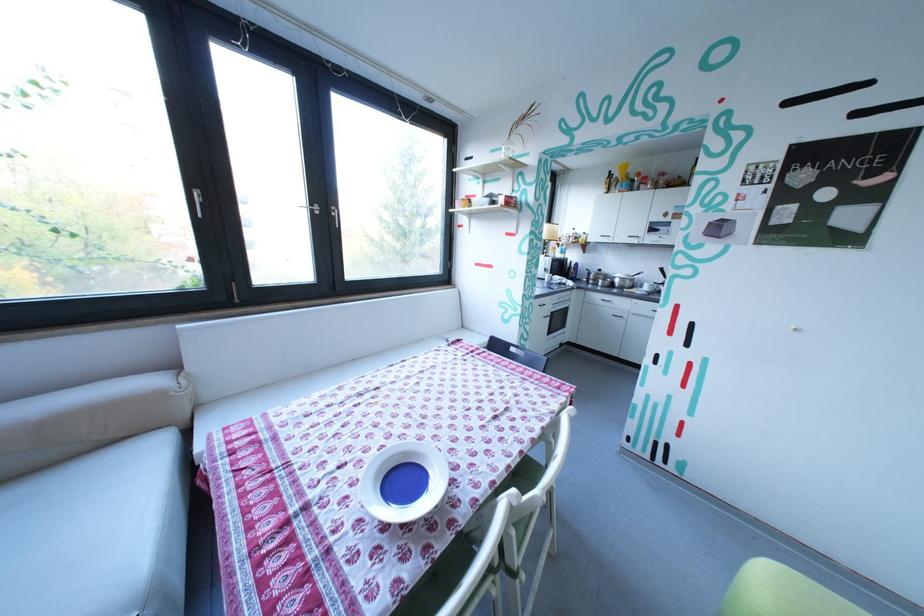
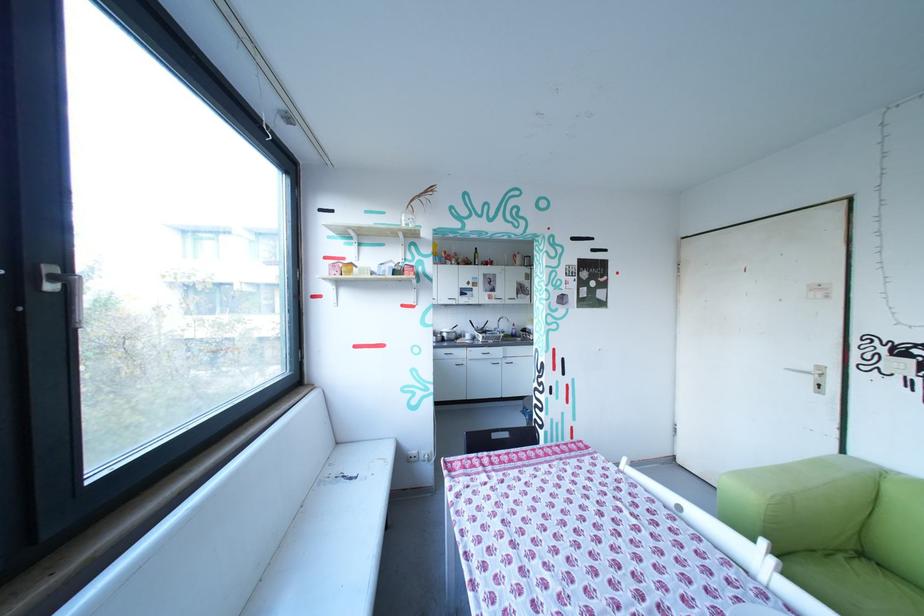
Find the pixel in the second image that matches point 525,349 in the first image.

(507, 436)